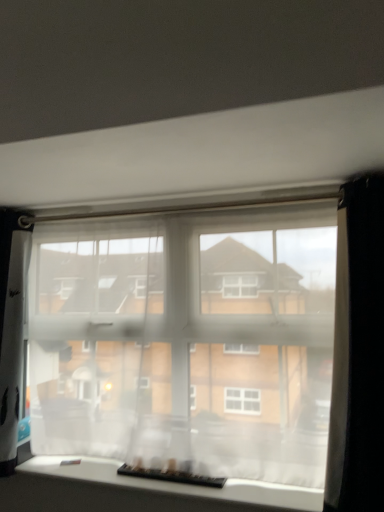
Question: Is translucent fabric at bottom, marked as the 2th window in a top-to-bottom arrangement, at the back of black plastic keyboard at lower center?

Choices:
 (A) yes
 (B) no

Answer: (B)

Question: Considering the relative sizes of black plastic keyboard at lower center and translucent fabric at bottom, marked as the 2th window in a top-to-bottom arrangement, in the image provided, is black plastic keyboard at lower center bigger than translucent fabric at bottom, marked as the 2th window in a top-to-bottom arrangement,?

Choices:
 (A) no
 (B) yes

Answer: (A)

Question: From a real-world perspective, does black plastic keyboard at lower center sit lower than translucent fabric at bottom, marked as the 2th window in a top-to-bottom arrangement?

Choices:
 (A) no
 (B) yes

Answer: (A)

Question: Can you confirm if black plastic keyboard at lower center is taller than translucent fabric at bottom, marked as the 2th window in a top-to-bottom arrangement?

Choices:
 (A) yes
 (B) no

Answer: (B)

Question: Can you confirm if black plastic keyboard at lower center is shorter than translucent fabric at bottom, which is counted as the 1th window, starting from the bottom?

Choices:
 (A) yes
 (B) no

Answer: (A)

Question: Does black plastic keyboard at lower center come behind translucent fabric at bottom, marked as the 2th window in a top-to-bottom arrangement?

Choices:
 (A) no
 (B) yes

Answer: (B)

Question: Can you confirm if black sheer curtain at right is bigger than black plastic keyboard at lower center?

Choices:
 (A) yes
 (B) no

Answer: (A)

Question: Does black sheer curtain at right appear on the right side of black plastic keyboard at lower center?

Choices:
 (A) yes
 (B) no

Answer: (A)

Question: From the image's perspective, is black sheer curtain at right on top of black plastic keyboard at lower center?

Choices:
 (A) yes
 (B) no

Answer: (A)

Question: Is black sheer curtain at right taller than black plastic keyboard at lower center?

Choices:
 (A) no
 (B) yes

Answer: (B)

Question: From a real-world perspective, is black sheer curtain at right physically below black plastic keyboard at lower center?

Choices:
 (A) yes
 (B) no

Answer: (B)

Question: Is black sheer curtain at right smaller than black plastic keyboard at lower center?

Choices:
 (A) yes
 (B) no

Answer: (B)

Question: Is translucent fabric at center, which appears as the 2th window when ordered from the bottom, further to the viewer compared to translucent fabric at bottom, marked as the 2th window in a top-to-bottom arrangement?

Choices:
 (A) yes
 (B) no

Answer: (A)